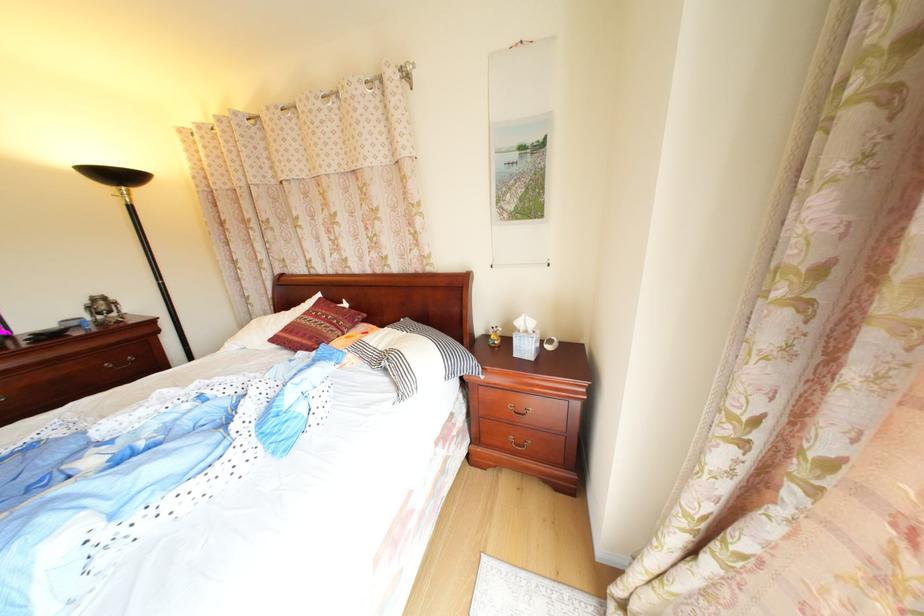
This screenshot has width=924, height=616. What do you see at coordinates (525, 338) in the screenshot?
I see `a white tissue box` at bounding box center [525, 338].